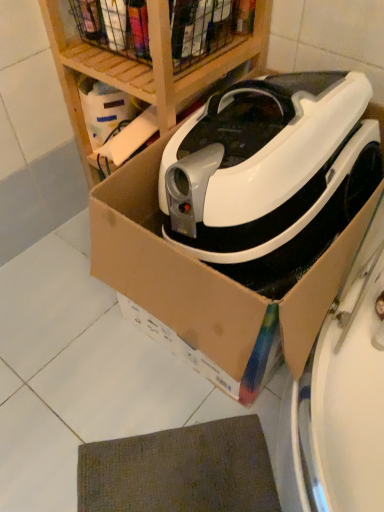
The height and width of the screenshot is (512, 384). Identify the location of vacant location below brown textured mat at lower center (from a real-world perspective). (171, 472).